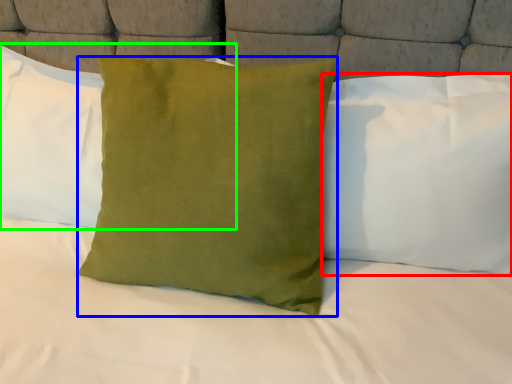
Question: Which object is positioned farthest from pillow (highlighted by a red box)? Select from pillow (highlighted by a blue box) and pillow (highlighted by a green box).

Choices:
 (A) pillow
 (B) pillow

Answer: (B)